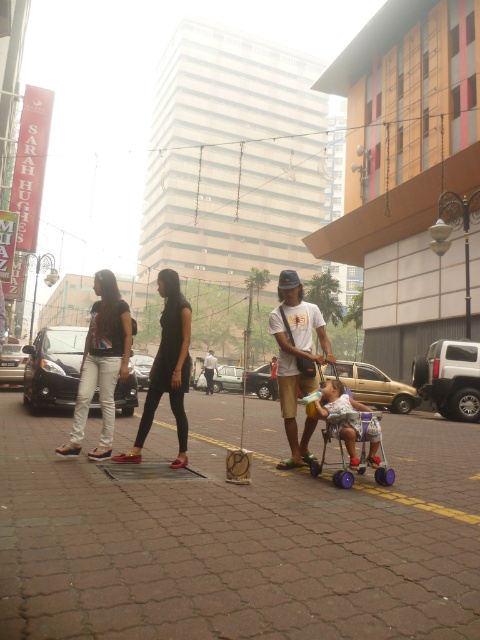
Looking at this image, you are a pedestrian trying to cross the street and see the brown brick pavement at center and the black matte dress at center. Which object is closer to you?

The brown brick pavement at center is closer to you because it is in front of the black matte dress at center.